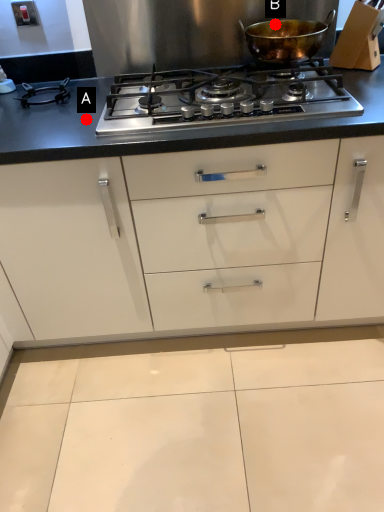
Question: Two points are circled on the image, labeled by A and B beside each circle. Which point is closer to the camera?

Choices:
 (A) A is closer
 (B) B is closer

Answer: (A)